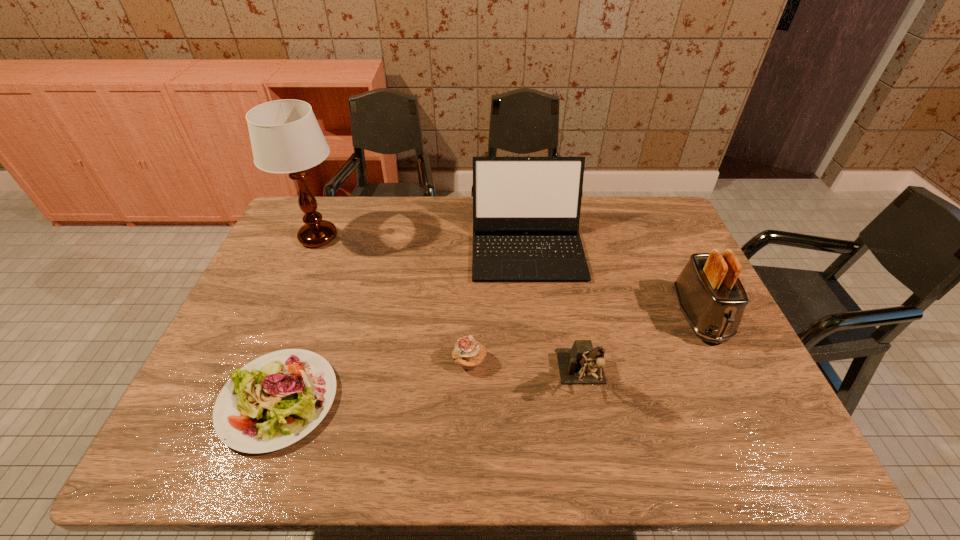
Image resolution: width=960 pixels, height=540 pixels. I want to click on vacant region located 0.240m on the back of the fifth tallest object, so click(x=471, y=283).

Where is `vacant area situated on the right of the shortest object`? Image resolution: width=960 pixels, height=540 pixels. vacant area situated on the right of the shortest object is located at coordinates (487, 400).

The image size is (960, 540). What are the coordinates of `table lamp that is at the far edge` in the screenshot? It's located at (285, 136).

Image resolution: width=960 pixels, height=540 pixels. Identify the location of laptop that is positioned at the far edge. (526, 210).

You are a GUI agent. You are given a task and a screenshot of the screen. Output one action in this format:
    pyautogui.click(x=<x>, y=<y>)
    Task: Click on the object located in the near edge section of the desktop
    
    Given the screenshot: What is the action you would take?
    pyautogui.click(x=275, y=400)

The image size is (960, 540). Identify the location of table lamp that is at the left edge. (285, 136).

Where is `salad plate present at the left edge`? Image resolution: width=960 pixels, height=540 pixels. salad plate present at the left edge is located at coordinates (275, 400).

The width and height of the screenshot is (960, 540). In order to click on object present at the right edge in this screenshot , I will do `click(712, 298)`.

Identify the location of object present at the far left corner. (285, 136).

Identify the location of object located at the near left corner. (275, 400).